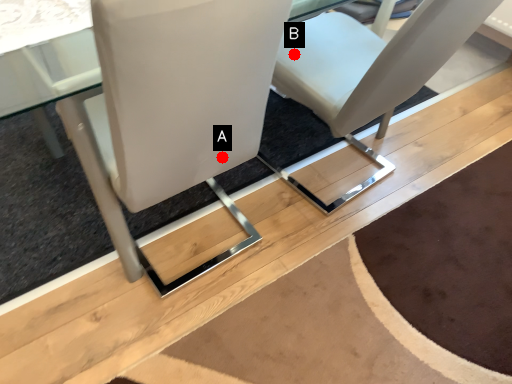
Question: Two points are circled on the image, labeled by A and B beside each circle. Among these points, which one is nearest to the camera?

Choices:
 (A) A is closer
 (B) B is closer

Answer: (A)